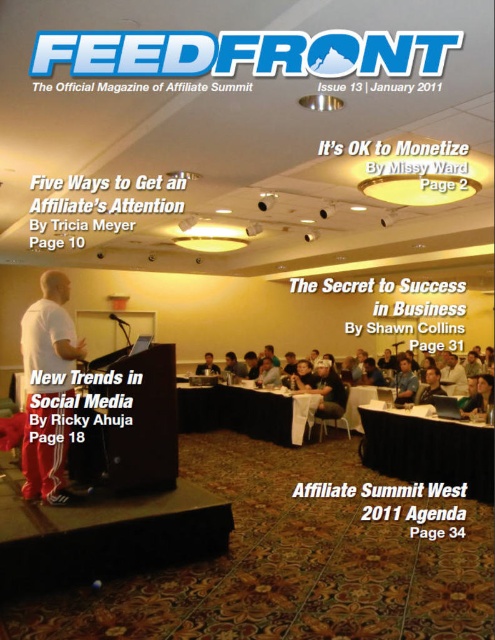
Question: Is white tablecloth at center bigger than light brown wooden table at center?

Choices:
 (A) yes
 (B) no

Answer: (A)

Question: Estimate the real-world distances between objects in this image. Which object is farther from the light brown leather jacket at center?

Choices:
 (A) black fabric table at center
 (B) white tablecloth at center

Answer: (A)

Question: Where is white tablecloth at center located in relation to light brown wooden table at center in the image?

Choices:
 (A) right
 (B) left

Answer: (A)

Question: In this image, where is white tablecloth at center located relative to light brown wooden table at center?

Choices:
 (A) above
 (B) below

Answer: (B)

Question: Which of these objects is positioned farthest from the light brown leather jacket at center?

Choices:
 (A) white matte shirt at center
 (B) black fabric table at center

Answer: (A)

Question: Estimate the real-world distances between objects in this image. Which object is closer to the black fabric table at center?

Choices:
 (A) white tablecloth at center
 (B) white matte shirt at center

Answer: (A)